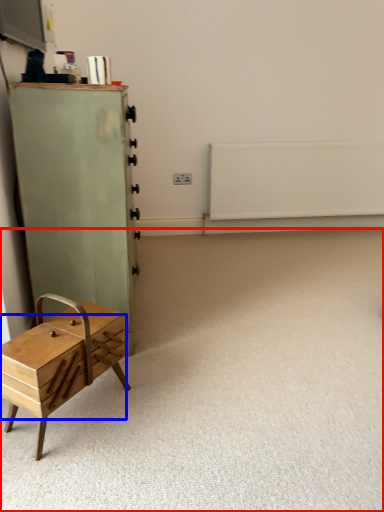
Question: Which of the following is the farthest to the observer, plain (highlighted by a red box) or drawer (highlighted by a blue box)?

Choices:
 (A) plain
 (B) drawer

Answer: (B)